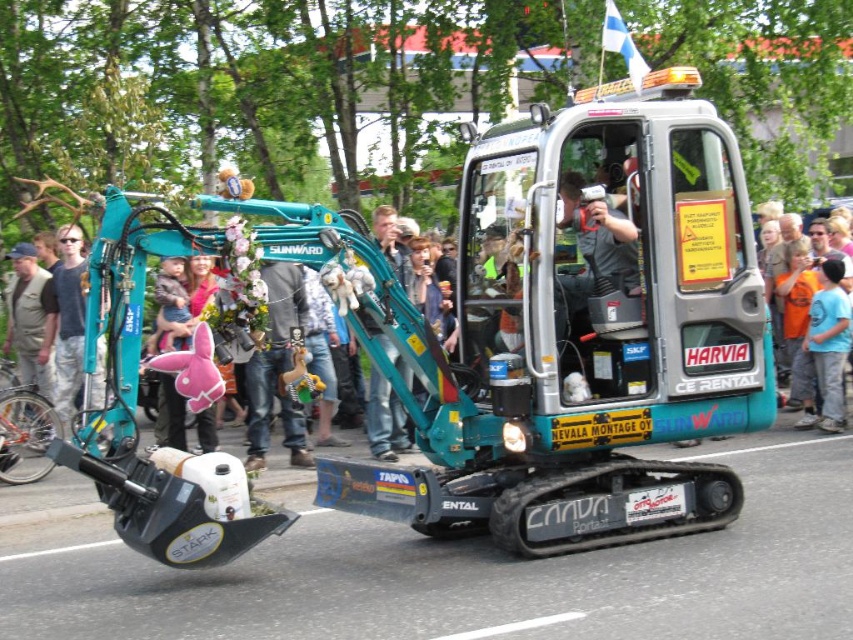
Who is higher up, orange cotton shirt at right or teal plastic excavator at center?

orange cotton shirt at right is above.

Identify the location of orange cotton shirt at right. The width and height of the screenshot is (853, 640). (793, 307).

The image size is (853, 640). Find the location of `orange cotton shirt at right`. orange cotton shirt at right is located at coordinates (793, 307).

I want to click on teal metallic excavator at center, so pos(564,326).

Is point (706, 481) behind point (813, 403)?

That is False.

In order to click on teal metallic excavator at center in this screenshot , I will do `click(564, 326)`.

Between teal metallic excavator at center and teal plastic excavator at center, which one appears on the right side from the viewer's perspective?

From the viewer's perspective, teal metallic excavator at center appears more on the right side.

Is teal metallic excavator at center to the left of teal plastic excavator at center from the viewer's perspective?

Incorrect, teal metallic excavator at center is not on the left side of teal plastic excavator at center.

Who is more distant from viewer, (132, 276) or (32, 422)?

The point (32, 422) is more distant.

Identify the location of teal metallic excavator at center. Image resolution: width=853 pixels, height=640 pixels. (564, 326).